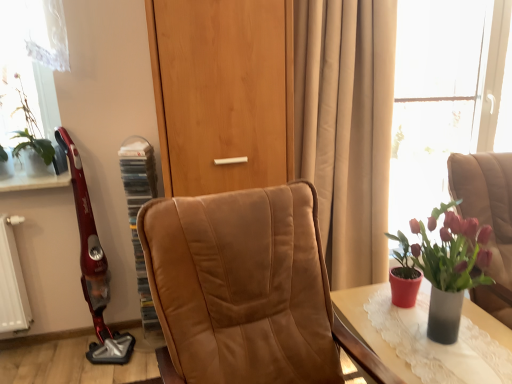
Describe the element at coordinates (93, 266) in the screenshot. The width and height of the screenshot is (512, 384). I see `metallic red vacuum cleaner at left` at that location.

What do you see at coordinates (488, 220) in the screenshot? I see `brown leather chair at right, which ranks as the first chair in right-to-left order` at bounding box center [488, 220].

Find the location of `brown leather chair at right, which ranks as the first chair in right-to-left order`. brown leather chair at right, which ranks as the first chair in right-to-left order is located at coordinates (488, 220).

Find the location of a particular element. This screenshot has width=512, height=384. beige fabric curtain at center is located at coordinates (346, 128).

The height and width of the screenshot is (384, 512). Describe the element at coordinates (370, 327) in the screenshot. I see `matte gray table at lower right` at that location.

The height and width of the screenshot is (384, 512). What do you see at coordinates (442, 95) in the screenshot?
I see `transparent glass window at upper right` at bounding box center [442, 95].

The image size is (512, 384). I want to click on leather chair at center, marked as the 2th chair in a right-to-left arrangement, so click(246, 290).

In terms of height, does metallic red vacuum cleaner at left look taller or shorter compared to green leafy plant at upper left, the first houseplant from the left?

Considering their sizes, metallic red vacuum cleaner at left has more height than green leafy plant at upper left, the first houseplant from the left.

In the scene shown: Is the surface of metallic red vacuum cleaner at left in direct contact with green leafy plant at upper left, which is the 2th houseplant in front-to-back order?

No, metallic red vacuum cleaner at left is not in contact with green leafy plant at upper left, which is the 2th houseplant in front-to-back order.

Could you tell me if metallic red vacuum cleaner at left is turned towards green leafy plant at upper left, which is the first houseplant from back to front?

No, metallic red vacuum cleaner at left is not facing towards green leafy plant at upper left, which is the first houseplant from back to front.

From the image's perspective, relative to green leafy plant at upper left, the first houseplant from the left, is metallic red vacuum cleaner at left above or below?

From the image's perspective, metallic red vacuum cleaner at left appears below green leafy plant at upper left, the first houseplant from the left.

How distant is transparent glass window at upper right from green leafy plant at upper left, which is counted as the first houseplant, starting from the top?

transparent glass window at upper right is 8.01 feet from green leafy plant at upper left, which is counted as the first houseplant, starting from the top.

In terms of size, does transparent glass window at upper right appear bigger or smaller than green leafy plant at upper left, the 2th houseplant ordered from the bottom?

Considering their sizes, transparent glass window at upper right takes up more space than green leafy plant at upper left, the 2th houseplant ordered from the bottom.

Is transparent glass window at upper right located outside green leafy plant at upper left, which is counted as the first houseplant, starting from the top?

Yes, transparent glass window at upper right is not within green leafy plant at upper left, which is counted as the first houseplant, starting from the top.

Can you confirm if transparent glass window at upper right is thinner than green leafy plant at upper left, which is the first houseplant from back to front?

Correct, the width of transparent glass window at upper right is less than that of green leafy plant at upper left, which is the first houseplant from back to front.

Which of these two, wooden door at center or leather chair at center, which is the first chair in left-to-right order, is smaller?

wooden door at center.

How different are the orientations of wooden door at center and leather chair at center, marked as the 2th chair in a right-to-left arrangement, in degrees?

11.5 degrees separate the facing orientations of wooden door at center and leather chair at center, marked as the 2th chair in a right-to-left arrangement.

Is wooden door at center situated inside leather chair at center, which is the first chair in left-to-right order, or outside?

wooden door at center is not enclosed by leather chair at center, which is the first chair in left-to-right order.

From the image's perspective, between matte gray table at lower right and beige fabric curtain at center, which one is located above?

beige fabric curtain at center is shown above in the image.

Can you confirm if matte gray table at lower right is thinner than beige fabric curtain at center?

No.

Is matte gray table at lower right to the right of beige fabric curtain at center from the viewer's perspective?

Yes, matte gray table at lower right is to the right of beige fabric curtain at center.

Considering the sizes of objects leather chair at center, marked as the 2th chair in a right-to-left arrangement, and matte gray table at lower right in the image provided, who is bigger, leather chair at center, marked as the 2th chair in a right-to-left arrangement, or matte gray table at lower right?

leather chair at center, marked as the 2th chair in a right-to-left arrangement.

Between point (234, 319) and point (360, 311), which one is positioned behind?

The point (360, 311) is behind.

Looking at this image, which object is wider, leather chair at center, marked as the 2th chair in a right-to-left arrangement, or matte gray table at lower right?

leather chair at center, marked as the 2th chair in a right-to-left arrangement.

What's the angular difference between leather chair at center, which is the first chair in left-to-right order, and matte gray table at lower right's facing directions?

The facing directions of leather chair at center, which is the first chair in left-to-right order, and matte gray table at lower right are 9.83 degrees apart.

From the image's perspective, which chair is the 1st one below the purple matte vase at right, which is the first houseplant from front to back? Please provide its 2D coordinates.

[(488, 220)]

From the image's perspective, is brown leather chair at right, acting as the second chair starting from the left, on purple matte vase at right, which ranks as the 2th houseplant in left-to-right order?

No, from the image's perspective, brown leather chair at right, acting as the second chair starting from the left, is not above purple matte vase at right, which ranks as the 2th houseplant in left-to-right order.

Is brown leather chair at right, which ranks as the first chair in right-to-left order, wider than purple matte vase at right, acting as the 1th houseplant starting from the bottom?

Correct, the width of brown leather chair at right, which ranks as the first chair in right-to-left order, exceeds that of purple matte vase at right, acting as the 1th houseplant starting from the bottom.

Based on the photo, is brown leather chair at right, acting as the second chair starting from the left, positioned with its back to purple matte vase at right, marked as the 2th houseplant in a back-to-front arrangement?

That's not correct — brown leather chair at right, acting as the second chair starting from the left, is not looking away from purple matte vase at right, marked as the 2th houseplant in a back-to-front arrangement.

From a real-world perspective, which is physically above, matte gray table at lower right or purple matte vase at right, marked as the 2th houseplant in a back-to-front arrangement?

In real-world perspective, purple matte vase at right, marked as the 2th houseplant in a back-to-front arrangement, is above.

Is purple matte vase at right, positioned as the second houseplant in top-to-bottom order, located within matte gray table at lower right?

No, purple matte vase at right, positioned as the second houseplant in top-to-bottom order, is not surrounded by matte gray table at lower right.

There is a matte gray table at lower right. Where is `the 1st houseplant above it (from a real-world perspective)`? The height and width of the screenshot is (384, 512). the 1st houseplant above it (from a real-world perspective) is located at coordinates (448, 266).

Considering the sizes of matte gray table at lower right and purple matte vase at right, marked as the 2th houseplant in a back-to-front arrangement, in the image, is matte gray table at lower right bigger or smaller than purple matte vase at right, marked as the 2th houseplant in a back-to-front arrangement,?

In the image, matte gray table at lower right appears to be larger than purple matte vase at right, marked as the 2th houseplant in a back-to-front arrangement.

Which houseplant is the 1st one when counting from the front of the metallic red vacuum cleaner at left? Please provide its 2D coordinates.

[(32, 140)]

Find the location of a particular element. The height and width of the screenshot is (384, 512). window beneath the green leafy plant at upper left, the 2th houseplant ordered from the bottom (from a real-world perspective) is located at coordinates (442, 95).

Considering their positions, is purple matte vase at right, marked as the first houseplant in a right-to-left arrangement, positioned closer to green leafy plant at upper left, which is the first houseplant from back to front, than wooden door at center?

wooden door at center lies closer to green leafy plant at upper left, which is the first houseplant from back to front, than the other object.

Considering their positions, is transparent glass window at upper right positioned further to wooden door at center than purple matte vase at right, positioned as the second houseplant in top-to-bottom order?

The object further to wooden door at center is transparent glass window at upper right.

Considering their positions, is transparent glass window at upper right positioned further to green leafy plant at upper left, the first houseplant from the left, than purple matte vase at right, positioned as the second houseplant in top-to-bottom order?

Among the two, transparent glass window at upper right is located further to green leafy plant at upper left, the first houseplant from the left.

From the image, which object appears to be farther from transparent glass window at upper right, purple matte vase at right, positioned as the second houseplant in top-to-bottom order, or brown leather chair at right, acting as the second chair starting from the left?

purple matte vase at right, positioned as the second houseplant in top-to-bottom order, is positioned further to the anchor transparent glass window at upper right.

From the picture: Considering their positions, is purple matte vase at right, marked as the first houseplant in a right-to-left arrangement, positioned further to beige fabric curtain at center than green leafy plant at upper left, the first houseplant from the left?

Based on the image, green leafy plant at upper left, the first houseplant from the left, appears to be further to beige fabric curtain at center.

Estimate the real-world distances between objects in this image. Which object is closer to wooden door at center, leather chair at center, which is the first chair in left-to-right order, or green leafy plant at upper left, which is the 2th houseplant in front-to-back order?

leather chair at center, which is the first chair in left-to-right order, is closer to wooden door at center.

Based on their spatial positions, is matte gray table at lower right or brown leather chair at right, acting as the second chair starting from the left, closer to metallic red vacuum cleaner at left?

Result: matte gray table at lower right is positioned closer to the anchor metallic red vacuum cleaner at left.

Considering their positions, is brown leather chair at right, acting as the second chair starting from the left, positioned closer to green leafy plant at upper left, placed as the second houseplant when sorted from right to left, than beige fabric curtain at center?

Among the two, beige fabric curtain at center is located nearer to green leafy plant at upper left, placed as the second houseplant when sorted from right to left.

Find the location of a particular element. The width and height of the screenshot is (512, 384). houseplant between metallic red vacuum cleaner at left and transparent glass window at upper right is located at coordinates (448, 266).

Where is `curtain between leather chair at center, marked as the 2th chair in a right-to-left arrangement, and brown leather chair at right, acting as the second chair starting from the left`? The image size is (512, 384). curtain between leather chair at center, marked as the 2th chair in a right-to-left arrangement, and brown leather chair at right, acting as the second chair starting from the left is located at coordinates (346, 128).

I want to click on curtain between green leafy plant at upper left, the 2th houseplant ordered from the bottom, and matte gray table at lower right from left to right, so click(346, 128).

This screenshot has width=512, height=384. Identify the location of door between metallic red vacuum cleaner at left and purple matte vase at right, which ranks as the 2th houseplant in left-to-right order. (223, 92).